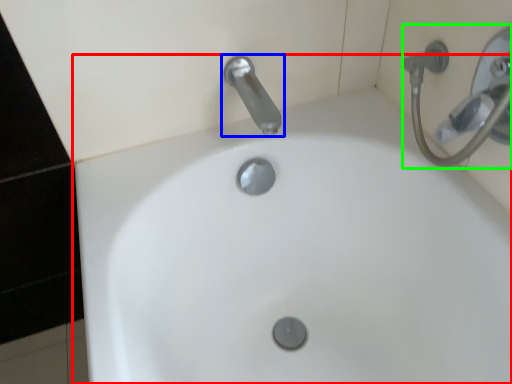
Question: Considering the real-world distances, which object is closest to sink (highlighted by a red box)? tap (highlighted by a blue box) or shower (highlighted by a green box).

Choices:
 (A) tap
 (B) shower

Answer: (A)